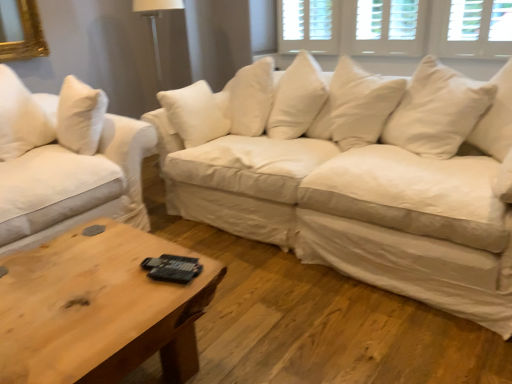
I want to click on free space above wooden rustic coffee table at center (from a real-world perspective), so click(x=77, y=274).